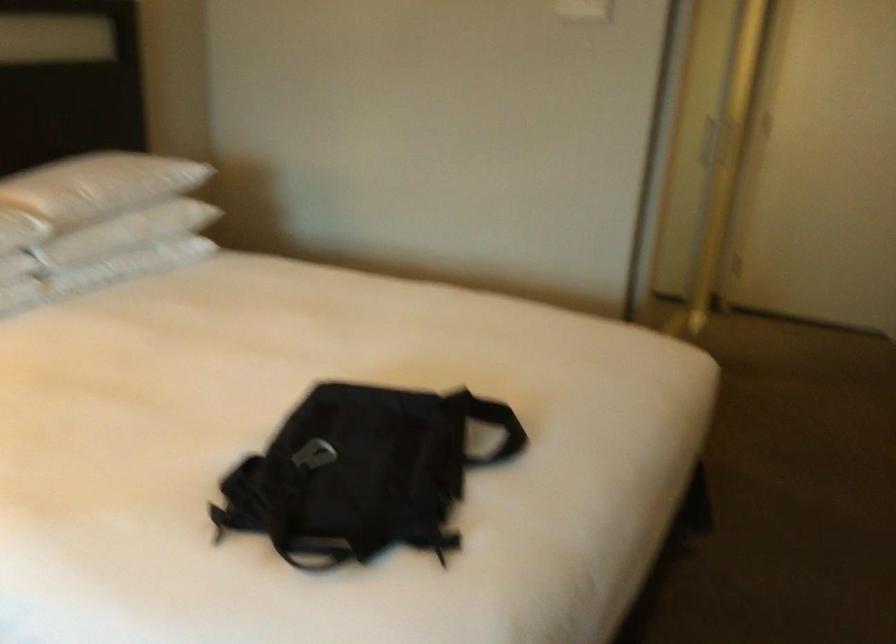
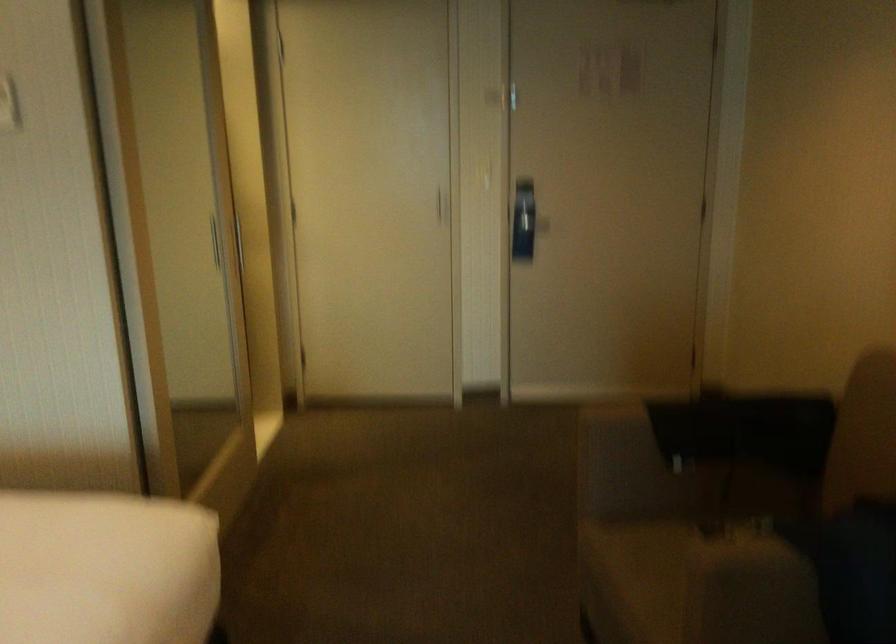
Consider the image. In a continuous first-person perspective shot, in which direction is the camera moving?

The cameraman walked toward right, forward.